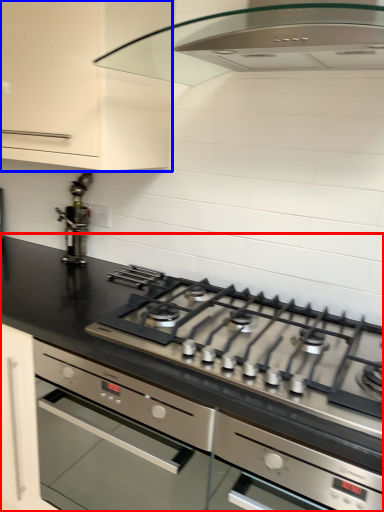
Question: Which object is closer to the camera taking this photo, countertop (highlighted by a red box) or cabinetry (highlighted by a blue box)?

Choices:
 (A) countertop
 (B) cabinetry

Answer: (A)